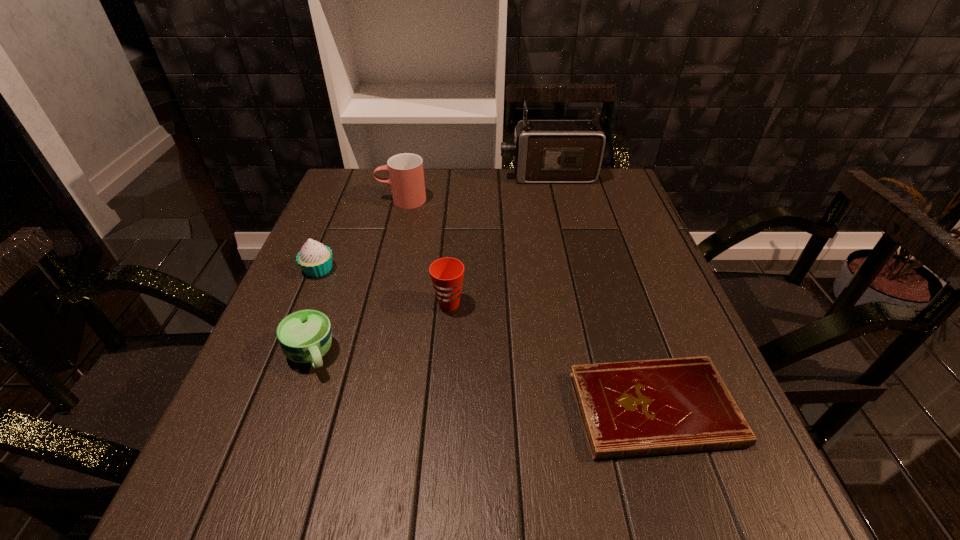
Identify the location of free space between the notebook and the fifth tallest object. This screenshot has width=960, height=540. (482, 382).

Identify which object is the third closest to the nearest cup. Please provide its 2D coordinates. Your answer should be formatted as a tuple, i.e. [(x, y)], where the tuple contains the x and y coordinates of a point satisfying the conditions above.

[(665, 406)]

Point out which object is positioned as the third nearest to the second nearest cup. Please provide its 2D coordinates. Your answer should be formatted as a tuple, i.e. [(x, y)], where the tuple contains the x and y coordinates of a point satisfying the conditions above.

[(315, 259)]

Locate an element on the screen. The image size is (960, 540). cup that is the third closest to the cupcake is located at coordinates (447, 274).

Identify which cup is located as the second nearest to the fourth nearest object. Please provide its 2D coordinates. Your answer should be formatted as a tuple, i.e. [(x, y)], where the tuple contains the x and y coordinates of a point satisfying the conditions above.

[(406, 175)]